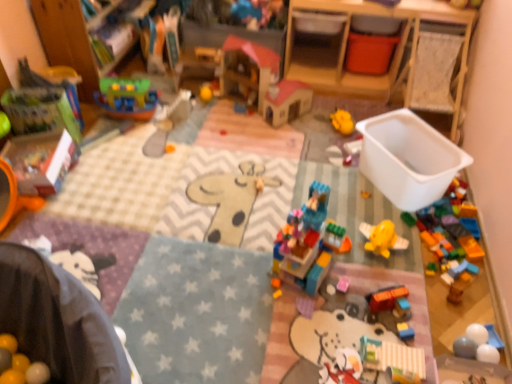
This screenshot has height=384, width=512. What are the coordinates of `free space between orange matte car at center, arranged as the ninth toy when viewed from the top, and wooden dollhouse at center, which is counted as the 9th toy, starting from the bottom` in the screenshot? It's located at (301, 165).